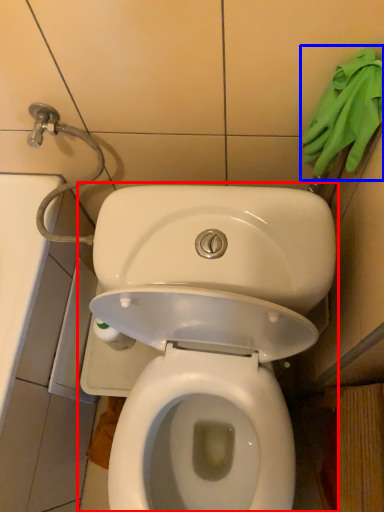
Question: Which object is further to the camera taking this photo, toilet (highlighted by a red box) or material (highlighted by a blue box)?

Choices:
 (A) toilet
 (B) material

Answer: (B)